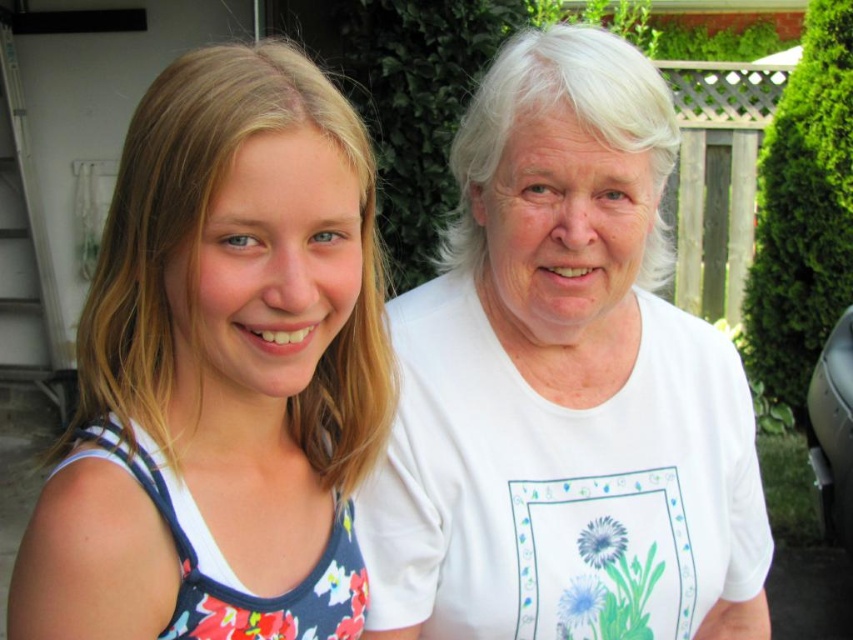
Question: Among these objects, which one is farthest from the camera?

Choices:
 (A) white cotton t-shirt at upper right
 (B) floral fabric dress at left
 (C) floral fabric tank top at left

Answer: (A)

Question: Which of the following is the closest to the observer?

Choices:
 (A) (96, 429)
 (B) (471, 614)

Answer: (A)

Question: Can you confirm if floral fabric dress at left is positioned above floral fabric tank top at left?

Choices:
 (A) no
 (B) yes

Answer: (B)

Question: Which object is farther from the camera taking this photo?

Choices:
 (A) floral fabric tank top at left
 (B) floral fabric dress at left
 (C) white cotton t-shirt at upper right

Answer: (C)

Question: Is white cotton t-shirt at upper right behind floral fabric dress at left?

Choices:
 (A) yes
 (B) no

Answer: (A)

Question: Where is floral fabric dress at left located in relation to floral fabric tank top at left in the image?

Choices:
 (A) left
 (B) right

Answer: (B)